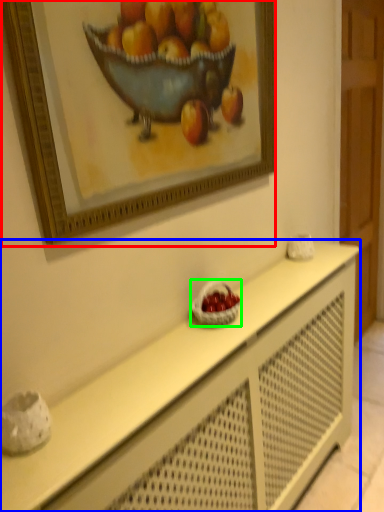
Question: Based on their relative distances, which object is farther from picture frame (highlighted by a red box)? Choose from table (highlighted by a blue box) and basket (highlighted by a green box).

Choices:
 (A) table
 (B) basket

Answer: (A)